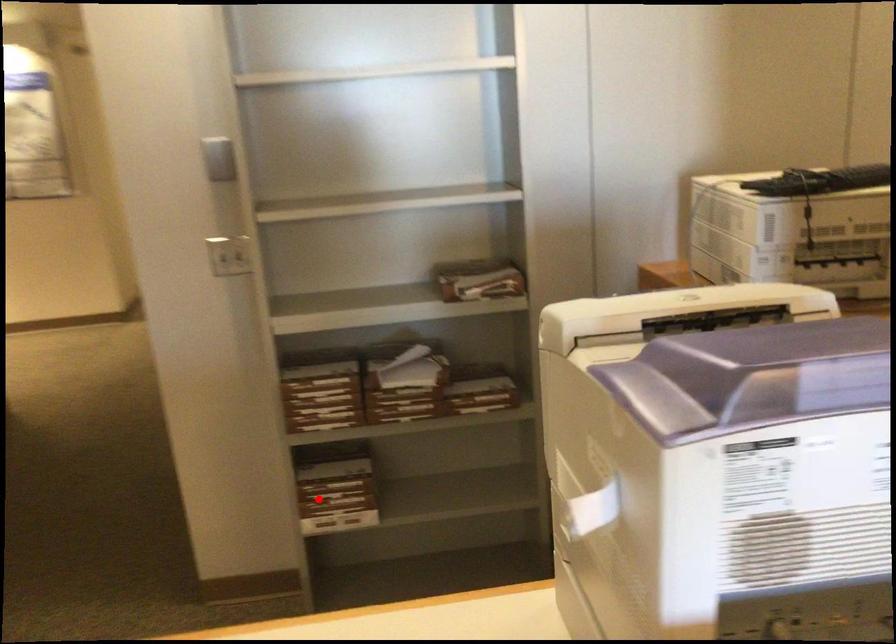
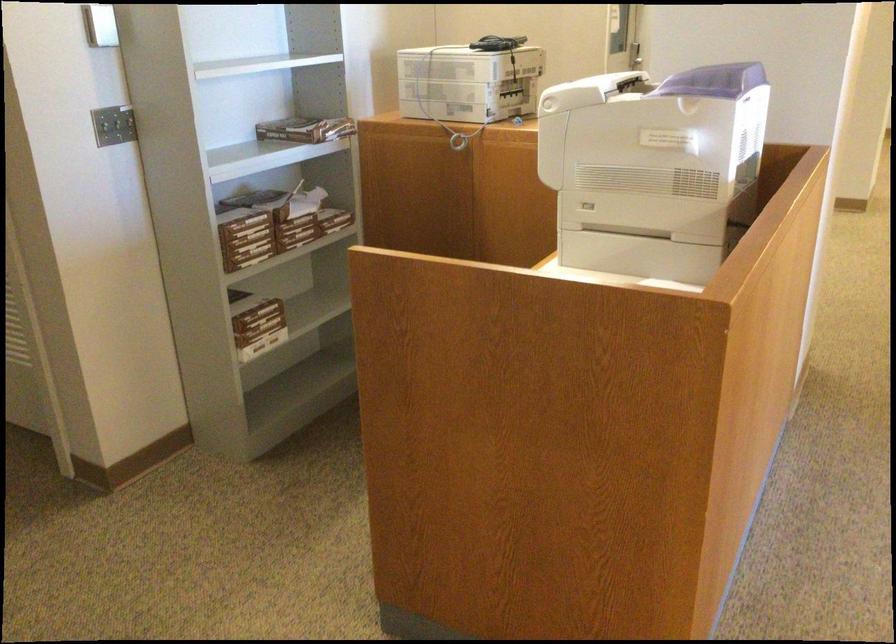
Find the pixel in the second image that matches the highlighted location in the first image.

(257, 321)